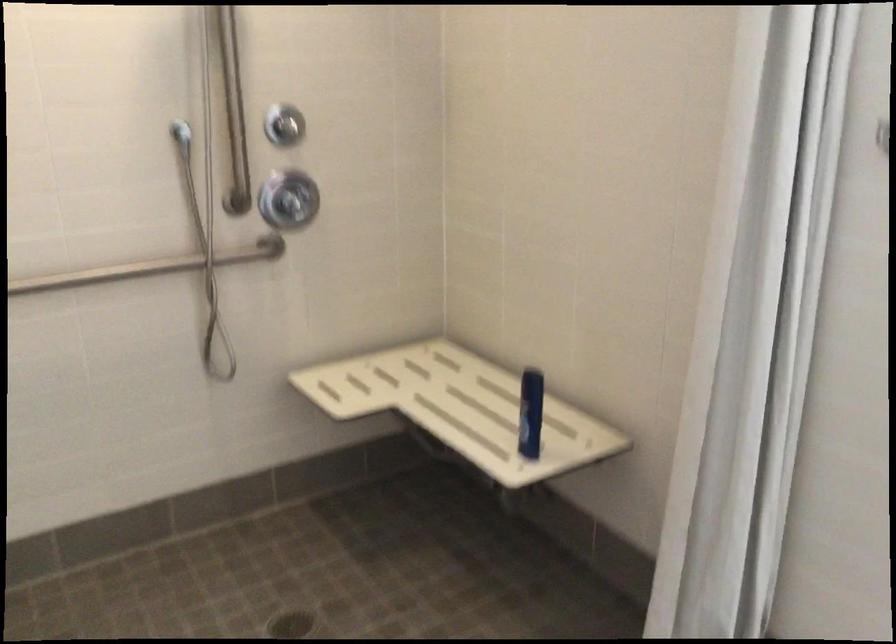
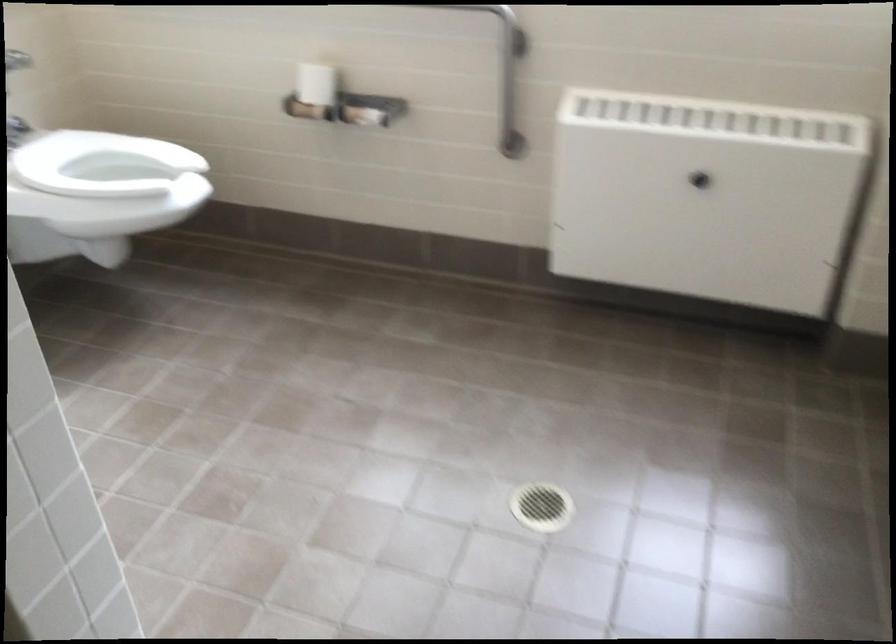
Based on the continuous images, in which direction is the camera rotating?

The camera rotated toward right-down.